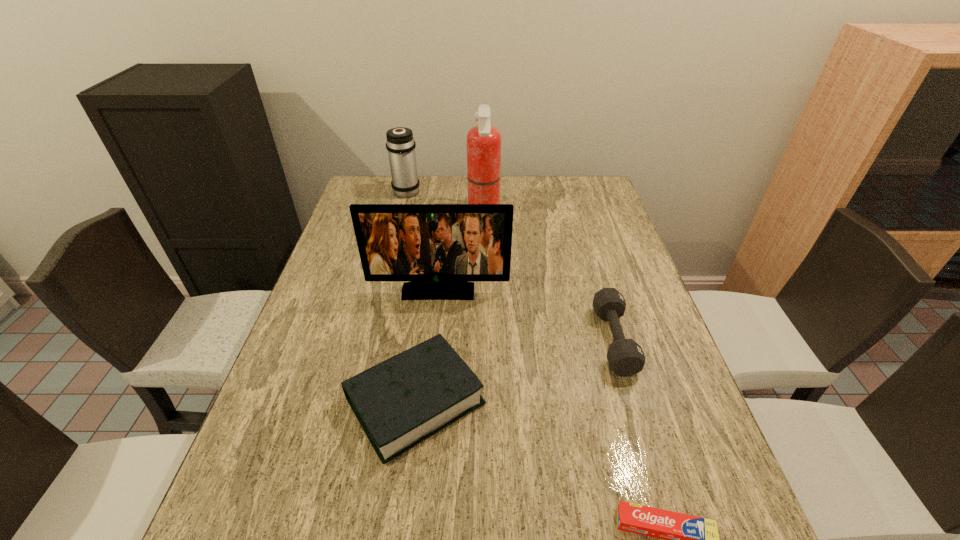
I want to click on vacant space at the left edge, so click(346, 214).

Where is `free region at the right edge of the desktop`? The image size is (960, 540). free region at the right edge of the desktop is located at coordinates (612, 223).

The height and width of the screenshot is (540, 960). Identify the location of free space at the far right corner of the desktop. (608, 204).

Identify the location of empty space that is in between the fire extinguisher and the Bible. (449, 307).

Find the location of a particular element. The width and height of the screenshot is (960, 540). free spot between the third tallest object and the tallest object is located at coordinates (445, 202).

Select which object is the second closest to the fifth shortest object. Please provide its 2D coordinates. Your answer should be formatted as a tuple, i.e. [(x, y)], where the tuple contains the x and y coordinates of a point satisfying the conditions above.

[(625, 357)]

This screenshot has width=960, height=540. I want to click on object that ranks as the closest to the tallest object, so click(400, 144).

You are a GUI agent. You are given a task and a screenshot of the screen. Output one action in this format:
    pyautogui.click(x=<x>, y=<y>)
    Task: Click on the vacant area in the image that satisfies the following two spatial constraints: 1. on the back side of the dumbbell; 2. on the left side of the Bible
    This screenshot has height=540, width=960.
    Given the screenshot: What is the action you would take?
    pyautogui.click(x=423, y=340)

Identify the location of vacant space that satisfies the following two spatial constraints: 1. with the handle and hose on the fire extinguisher; 2. on the front-facing side of the second tallest object. (485, 292).